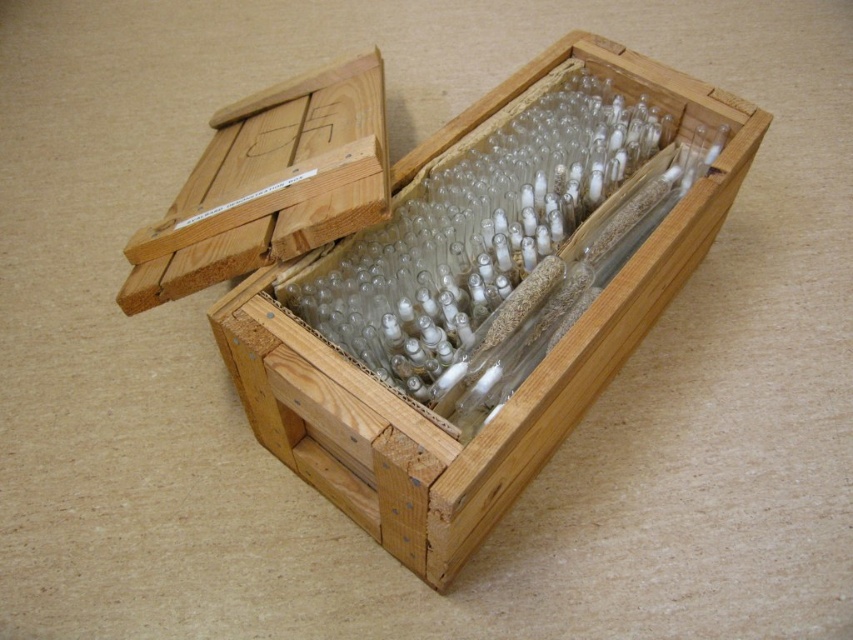
Based on the photo, you are organizing items in a storage area and need to place two natural wood boxes. You have a natural wood box at center and a natural wood box at upper left. According to the image, which one is positioned to the right of the other?

The natural wood box at center is to the right of natural wood box at upper left.

You are standing in a room where the natural wood box at center is placed on a table. If you want to reach the box without moving any furniture, which direction should you move relative to your current position?

The natural wood box at center is located at point (521, 384), so you should move towards the coordinates where the box is positioned to reach it without moving any furniture.